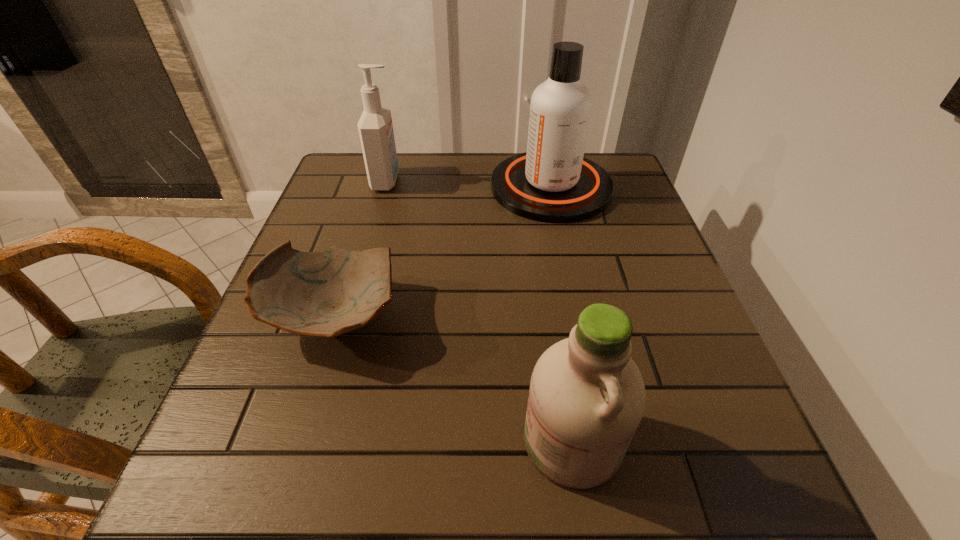
Locate an element on the screen. Image resolution: width=960 pixels, height=540 pixels. cleansing agent positioned at the left edge is located at coordinates (375, 127).

Where is `pottery positioned at the left edge`? The image size is (960, 540). pottery positioned at the left edge is located at coordinates (326, 293).

The width and height of the screenshot is (960, 540). Identify the location of object that is at the right edge. (552, 182).

Where is `object situated at the far left corner`? The height and width of the screenshot is (540, 960). object situated at the far left corner is located at coordinates (375, 127).

At what (x,y) coordinates should I click in order to perform the action: click on object that is at the far right corner. Please return your answer as a coordinate pair (x, y). Looking at the image, I should click on (552, 182).

The height and width of the screenshot is (540, 960). I want to click on vacant space at the far edge of the desktop, so click(x=428, y=155).

Image resolution: width=960 pixels, height=540 pixels. In the image, there is a desktop. Find the location of `free space at the near edge`. free space at the near edge is located at coordinates (564, 521).

At what (x,y) coordinates should I click in order to perform the action: click on vacant area at the left edge of the desktop. Please return your answer as a coordinate pair (x, y). This screenshot has width=960, height=540. Looking at the image, I should click on (352, 231).

This screenshot has height=540, width=960. Find the location of `vacant space at the right edge`. vacant space at the right edge is located at coordinates (632, 228).

I want to click on vacant space at the far left corner of the desktop, so click(359, 188).